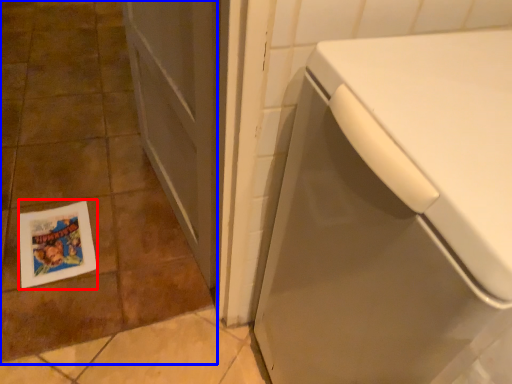
Question: Which of the following is the closest to the observer, flyer (highlighted by a red box) or ceramic tile (highlighted by a blue box)?

Choices:
 (A) flyer
 (B) ceramic tile

Answer: (B)